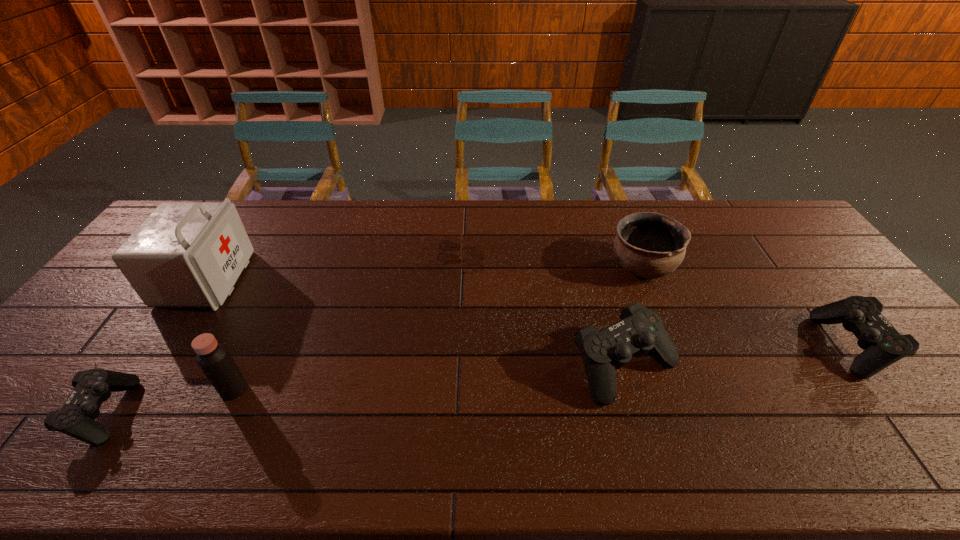
Identify the location of object present at the left edge. (184, 254).

This screenshot has height=540, width=960. In order to click on object that is at the right edge in this screenshot , I will do `click(883, 345)`.

In the image, there is a desktop. Where is `vacant space at the far edge`? vacant space at the far edge is located at coordinates (733, 226).

In the image, there is a desktop. At what (x,y) coordinates should I click in order to perform the action: click on vacant space at the near edge. Please return your answer as a coordinate pair (x, y). Looking at the image, I should click on (605, 413).

Identify the location of free space at the right edge of the desktop. (910, 375).

In the image, there is a desktop. Identify the location of free space at the far right corner. (769, 206).

Find the location of a particular element. vacant area that lies between the rightmost object and the sixth tallest object is located at coordinates (478, 379).

At what (x,y) coordinates should I click in order to perform the action: click on free spot between the leftmost control and the pottery. Please return your answer as a coordinate pair (x, y). The height and width of the screenshot is (540, 960). Looking at the image, I should click on (373, 340).

The height and width of the screenshot is (540, 960). Identify the location of unoccupied position between the second control from left to right and the fourth object from left to right. (534, 310).

Find the location of a particular element. This screenshot has height=540, width=960. free spot between the fifth tallest object and the fourth tallest object is located at coordinates (738, 356).